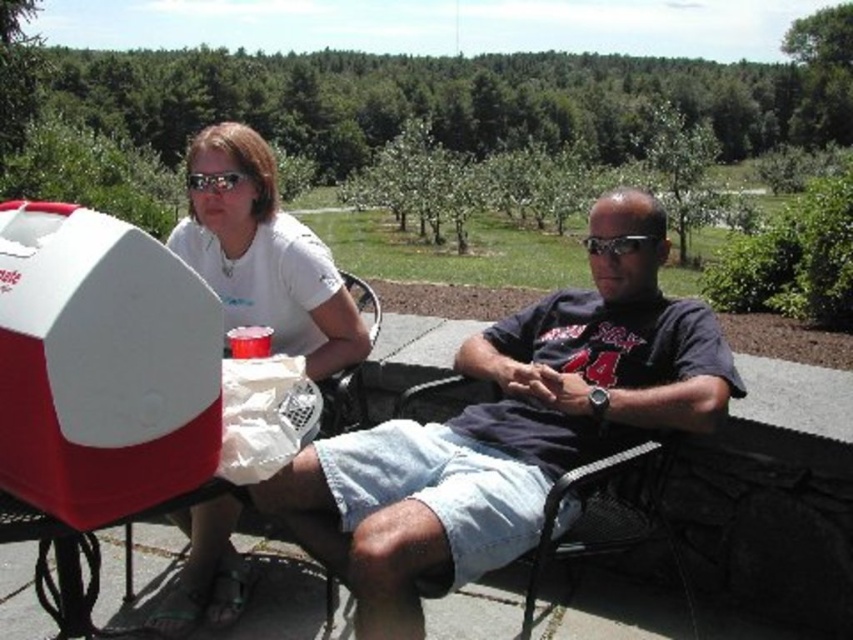
Does denim shorts at center have a larger size compared to white matte t-shirt at upper left?

Actually, denim shorts at center might be smaller than white matte t-shirt at upper left.

Consider the image. Can you confirm if denim shorts at center is wider than white matte t-shirt at upper left?

Yes.

Between point (581, 451) and point (318, 241), which one is positioned behind?

Point (318, 241)

Where is `denim shorts at center`? denim shorts at center is located at coordinates (509, 429).